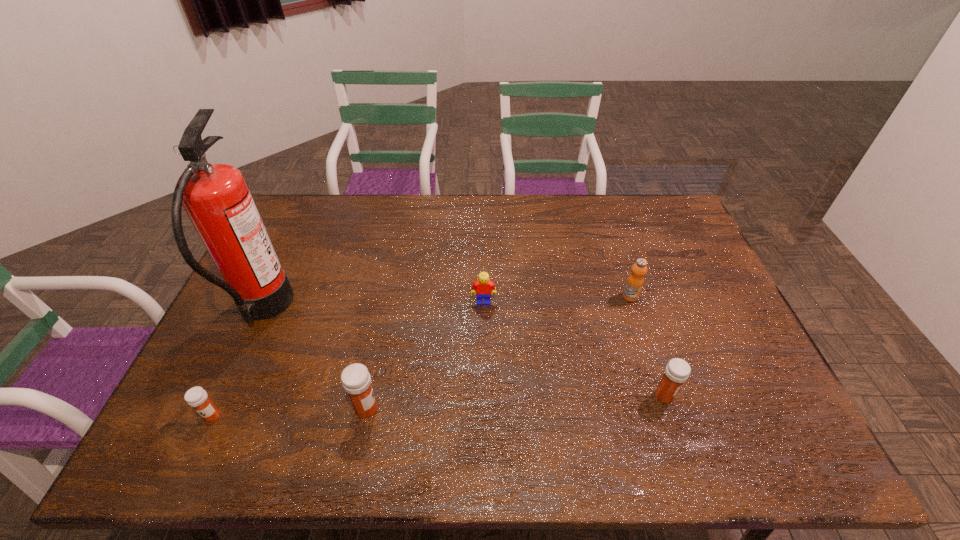
The image size is (960, 540). I want to click on free space at the far left corner of the desktop, so click(x=315, y=202).

Identify the location of vacant point located between the tallest medicine and the rightmost medicine. 516,402.

I want to click on free point between the leftmost medicine and the rightmost medicine, so click(x=438, y=406).

Where is `free space between the third object from right to left and the fire extinguisher`? The height and width of the screenshot is (540, 960). free space between the third object from right to left and the fire extinguisher is located at coordinates (373, 306).

Locate an element on the screen. This screenshot has height=540, width=960. free spot between the tallest medicine and the rightmost medicine is located at coordinates [x=516, y=402].

The height and width of the screenshot is (540, 960). In order to click on unoccupied position between the Lego and the orange juice in this screenshot , I will do `click(557, 299)`.

Locate an element on the screen. free space that is in between the second medicine from left to right and the shortest object is located at coordinates (289, 413).

Find the location of a particular element. The width and height of the screenshot is (960, 540). blank region between the fire extinguisher and the second medicine from left to right is located at coordinates (315, 360).

Find the location of a particular element. Image resolution: width=960 pixels, height=540 pixels. vacant space that's between the second tallest medicine and the fire extinguisher is located at coordinates (464, 353).

At what (x,y) coordinates should I click in order to perform the action: click on unoccupied position between the Lego and the tallest medicine. Please return your answer as a coordinate pair (x, y). The image size is (960, 540). Looking at the image, I should click on (425, 355).